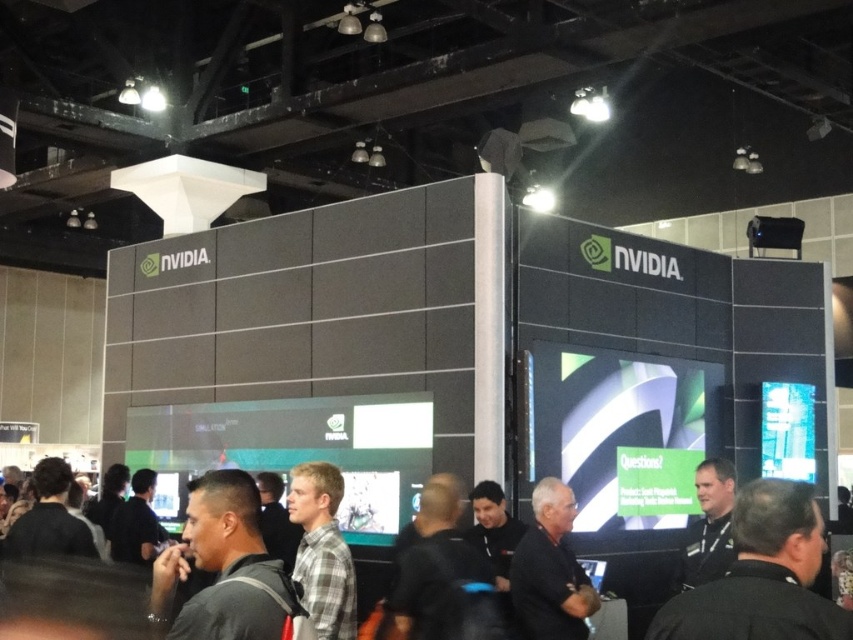
Does black uniform at center appear on the right side of black shirt at center?

Indeed, black uniform at center is positioned on the right side of black shirt at center.

I want to click on black uniform at center, so tap(762, 576).

Is black uniform at center shorter than dark gray shirt at center?

Yes, black uniform at center is shorter than dark gray shirt at center.

Is point (715, 586) behind point (221, 634)?

No, it is in front of (221, 634).

You are a GUI agent. You are given a task and a screenshot of the screen. Output one action in this format:
    pyautogui.click(x=<x>, y=<y>)
    Task: Click on the black uniform at center
    
    Given the screenshot: What is the action you would take?
    pyautogui.click(x=762, y=576)

Is dark gray shirt at center wider than black shirt at center?

Yes, dark gray shirt at center is wider than black shirt at center.

Does dark gray shirt at center have a lesser height compared to black shirt at center?

In fact, dark gray shirt at center may be taller than black shirt at center.

Is point (262, 596) positioned before point (547, 588)?

Yes.

The width and height of the screenshot is (853, 640). Identify the location of dark gray shirt at center. (224, 566).